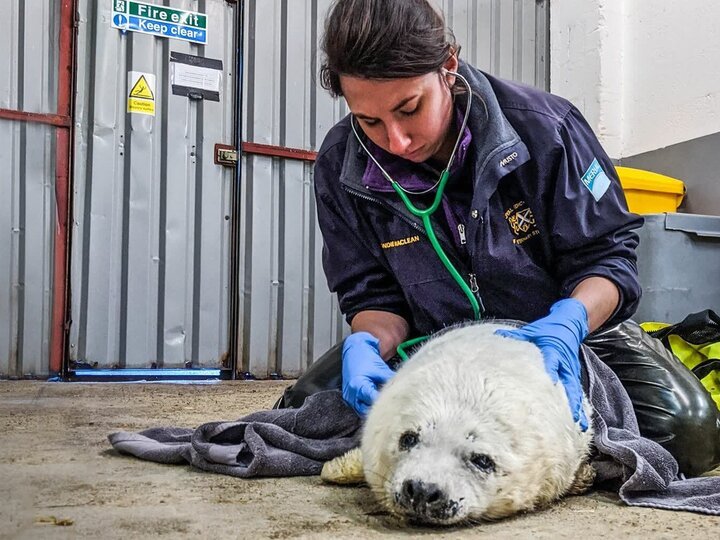
The image size is (720, 540). What are the coordinates of `door` in the screenshot? It's located at click(96, 209), click(68, 261).